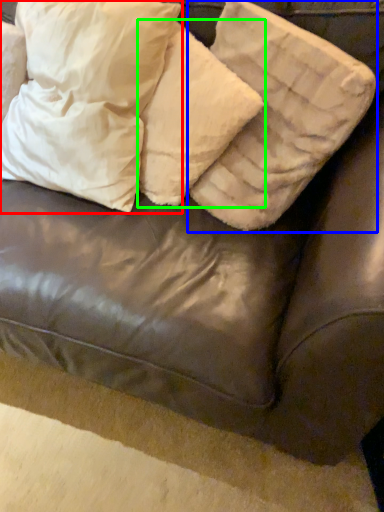
Question: Based on their relative distances, which object is farther from pillow (highlighted by a red box)? Choose from pillow (highlighted by a blue box) and pillow (highlighted by a green box).

Choices:
 (A) pillow
 (B) pillow

Answer: (A)